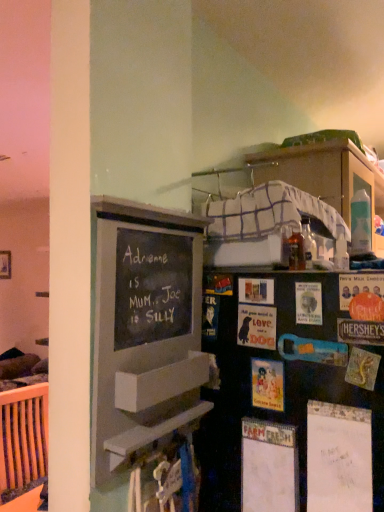
Question: From a real-world perspective, does chalkboard paint bulletin board at left sit lower than matte paper postcard at center, positioned as the 2th postcard in left-to-right order?

Choices:
 (A) no
 (B) yes

Answer: (A)

Question: Considering the relative positions of chalkboard paint bulletin board at left and matte paper postcard at center, positioned as the 2th postcard in left-to-right order, in the image provided, is chalkboard paint bulletin board at left to the left of matte paper postcard at center, positioned as the 2th postcard in left-to-right order, from the viewer's perspective?

Choices:
 (A) no
 (B) yes

Answer: (B)

Question: Is chalkboard paint bulletin board at left outside matte paper postcard at center, which appears as the 3th postcard when viewed from the right?

Choices:
 (A) yes
 (B) no

Answer: (A)

Question: From the image's perspective, is chalkboard paint bulletin board at left beneath matte paper postcard at center, positioned as the 2th postcard in left-to-right order?

Choices:
 (A) no
 (B) yes

Answer: (A)

Question: Can you confirm if chalkboard paint bulletin board at left is taller than matte paper postcard at center, positioned as the 2th postcard in left-to-right order?

Choices:
 (A) no
 (B) yes

Answer: (B)

Question: Is chalkboard paint bulletin board at left next to matte paper postcard at center, which appears as the 3th postcard when viewed from the right, and touching it?

Choices:
 (A) no
 (B) yes

Answer: (A)

Question: From a real-world perspective, is matte paper postcard at center, acting as the 4th postcard starting from the right, positioned under matte paper postcard at center, which appears as the 3th postcard when viewed from the right, based on gravity?

Choices:
 (A) yes
 (B) no

Answer: (B)

Question: Is matte paper postcard at center, acting as the 4th postcard starting from the right, bigger than matte paper postcard at center, which appears as the 3th postcard when viewed from the right?

Choices:
 (A) no
 (B) yes

Answer: (B)

Question: Considering the relative sizes of matte paper postcard at center, marked as the 1th postcard in a left-to-right arrangement, and matte paper postcard at center, positioned as the 2th postcard in left-to-right order, in the image provided, is matte paper postcard at center, marked as the 1th postcard in a left-to-right arrangement, thinner than matte paper postcard at center, positioned as the 2th postcard in left-to-right order,?

Choices:
 (A) no
 (B) yes

Answer: (B)

Question: Is matte paper postcard at center, marked as the 1th postcard in a left-to-right arrangement, not within matte paper postcard at center, positioned as the 2th postcard in left-to-right order?

Choices:
 (A) yes
 (B) no

Answer: (A)

Question: Considering the relative sizes of matte paper postcard at center, acting as the 4th postcard starting from the right, and matte paper postcard at center, positioned as the 2th postcard in left-to-right order, in the image provided, is matte paper postcard at center, acting as the 4th postcard starting from the right, smaller than matte paper postcard at center, positioned as the 2th postcard in left-to-right order,?

Choices:
 (A) yes
 (B) no

Answer: (B)

Question: Is matte paper postcard at center, acting as the 4th postcard starting from the right, positioned behind matte paper postcard at center, positioned as the 2th postcard in left-to-right order?

Choices:
 (A) no
 (B) yes

Answer: (B)

Question: From the image's perspective, is chalkboard paint bulletin board at left below matte cardboard postcard at right, which is the fourth postcard from left to right?

Choices:
 (A) yes
 (B) no

Answer: (A)